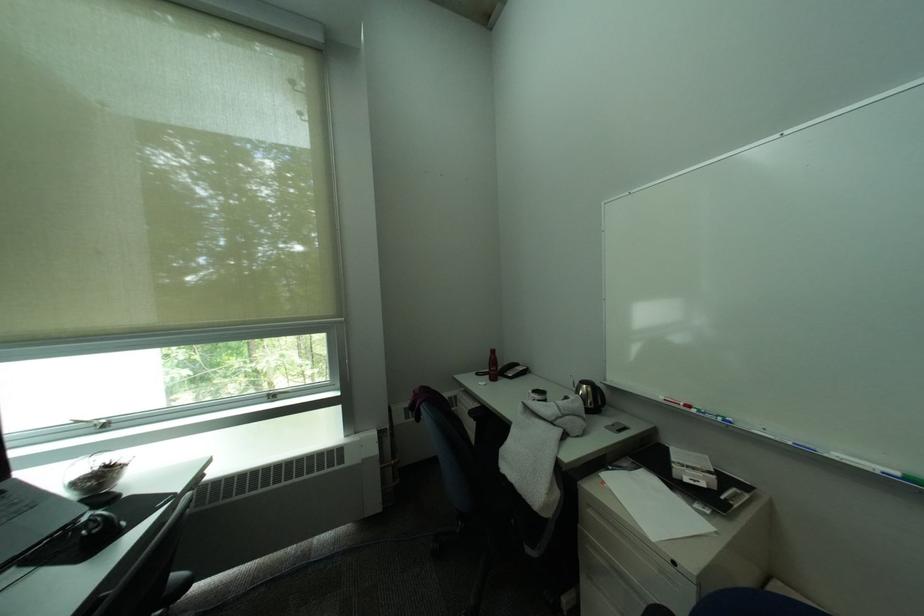
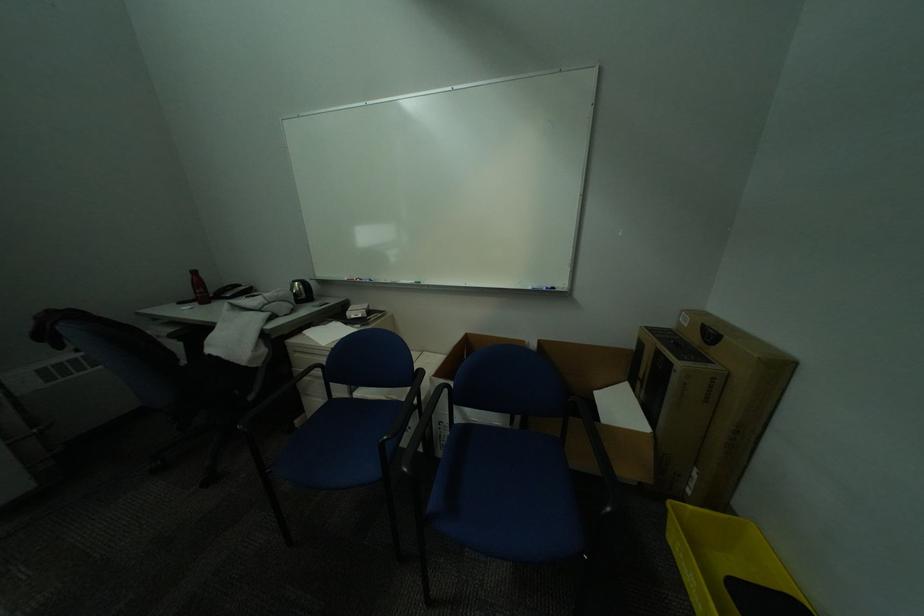
Question: Based on the continuous images, in which direction is the camera rotating? Reply with the corresponding letter.

Choices:
 (A) Left
 (B) Right
 (C) Up
 (D) Down

Answer: (B)